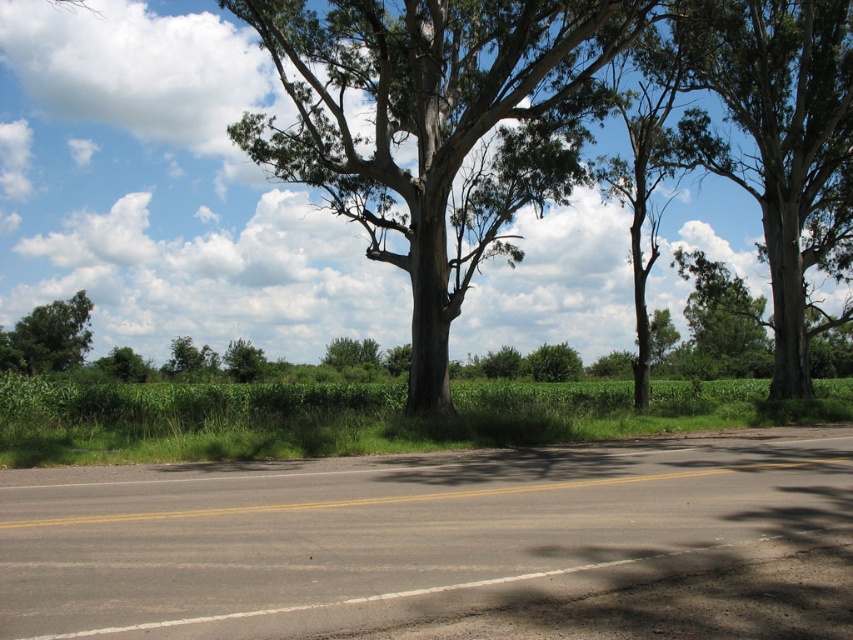
You are driving a car and want to know if the green rough bark tree at center is taller than the green rough bark tree at upper right. Based on the scene, can you determine which tree is taller?

The green rough bark tree at center has a greater height compared to the green rough bark tree at upper right, so the tree at center is taller.

You are a delivery driver who needs to ensure your truck can pass through the narrowest part of the road between the green rough bark tree at center and the green rough bark tree at upper right. Based on the scene description, can you determine if the truck, which is 2.5 meters wide, will fit through the space between them?

The green rough bark tree at center might be wider than the green rough bark tree at upper right, so the space between them could be narrower than expected. However, without exact measurements, it is uncertain if the 2.5 meter wide truck will fit safely. Proceed with caution and check the actual width on site.

You are a surveyor measuring the distance between two trees along a rural road. You have a measuring tape that can extend up to 30 meters. You need to determine if you can measure the distance between the green rough bark tree at center and the green matte tree at center without needing a longer tape. Can you do it?

The distance between the green rough bark tree at center and the green matte tree at center is 37.92 meters. Since your measuring tape can only extend up to 30 meters, you cannot measure the full distance between them without a longer tape.